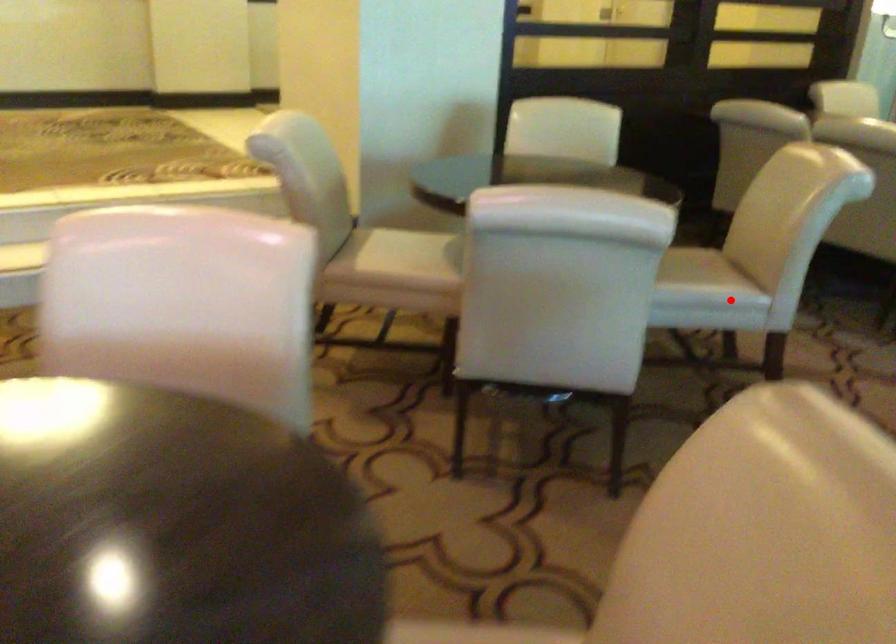
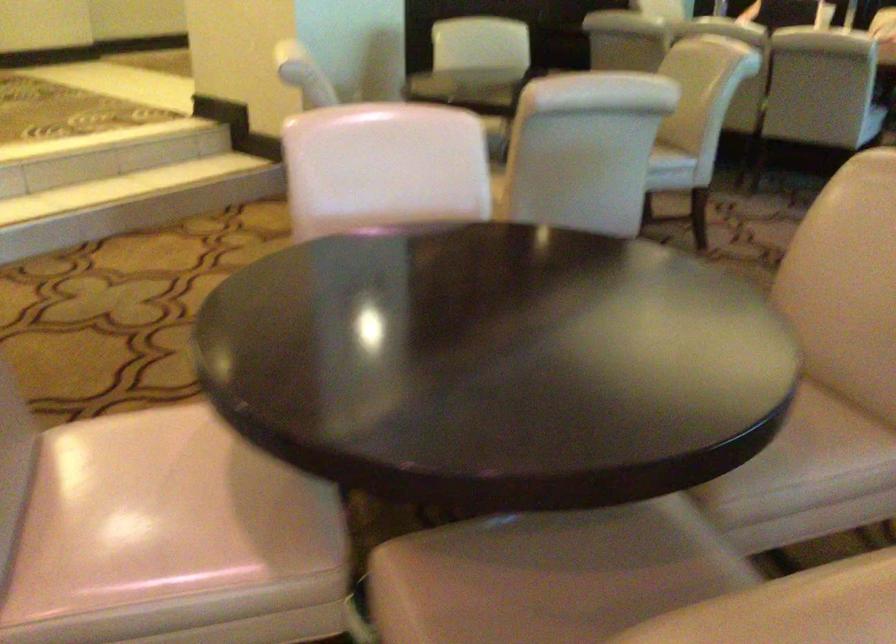
The point at the highlighted location is marked in the first image. Where is the corresponding point in the second image?

(670, 163)